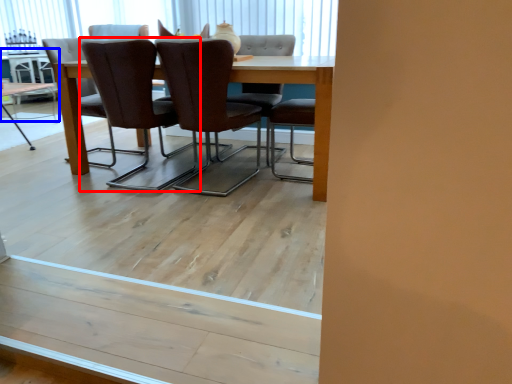
Question: Which of the following is the closest to the observer, chair (highlighted by a red box) or table (highlighted by a blue box)?

Choices:
 (A) chair
 (B) table

Answer: (A)